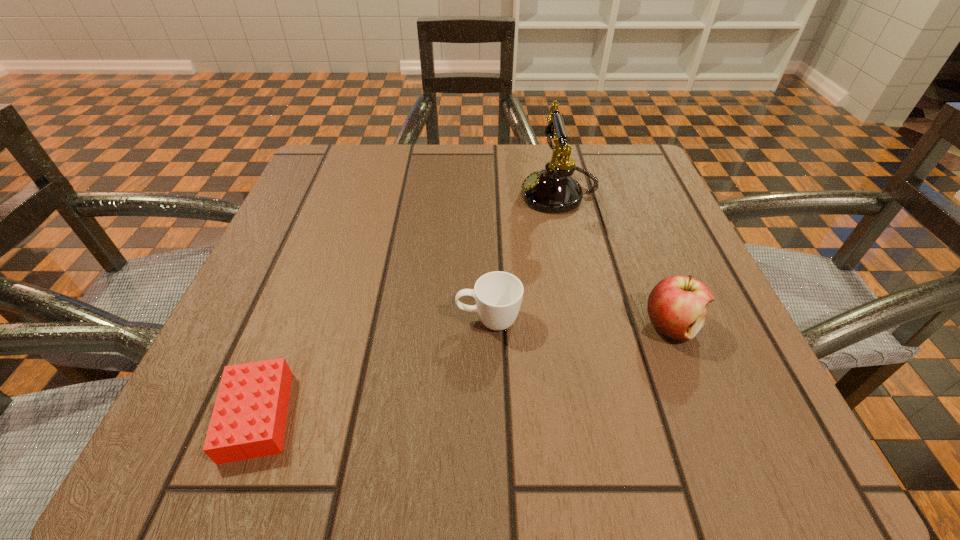
Locate an element on the screen. The width and height of the screenshot is (960, 540). free space located on the dial of the farthest object is located at coordinates (408, 194).

Identify the location of vacant space located 0.050m on the back of the third shortest object. (654, 282).

Locate an element on the screen. blank space located 0.190m with the handle on the side of the third tallest object is located at coordinates (330, 320).

Locate an element on the screen. The image size is (960, 540). vacant space situated 0.050m with the handle on the side of the third tallest object is located at coordinates (423, 320).

The height and width of the screenshot is (540, 960). Identify the location of free space located with the handle on the side of the third tallest object. (403, 320).

Where is `free space located 0.090m on the right of the Lego`? free space located 0.090m on the right of the Lego is located at coordinates (366, 416).

The width and height of the screenshot is (960, 540). Identify the location of object positioned at the far edge. (552, 190).

Find the location of a particular element. The height and width of the screenshot is (540, 960). object that is at the near edge is located at coordinates (248, 421).

At what (x,y) coordinates should I click in order to perform the action: click on object that is positioned at the left edge. Please return your answer as a coordinate pair (x, y). Image resolution: width=960 pixels, height=540 pixels. Looking at the image, I should click on (248, 421).

Locate an element on the screen. telephone positioned at the right edge is located at coordinates (552, 190).